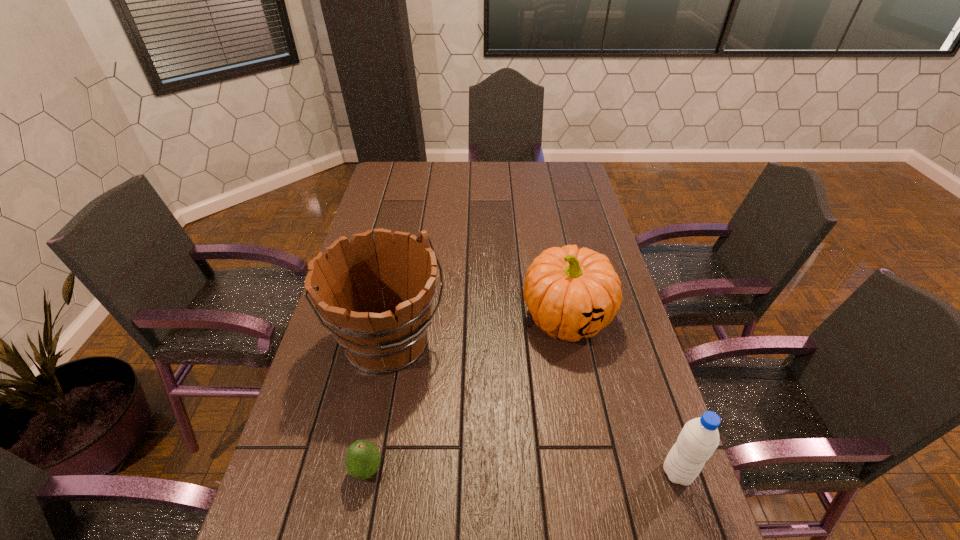
Locate an element on the screen. Image resolution: width=960 pixels, height=540 pixels. vacant space that is in between the rightmost object and the pumpkin is located at coordinates (622, 395).

You are a GUI agent. You are given a task and a screenshot of the screen. Output one action in this format:
    pyautogui.click(x=<x>, y=<y>)
    Task: Click on the free space between the avocado and the tallest object
    This screenshot has width=960, height=540.
    Given the screenshot: What is the action you would take?
    pyautogui.click(x=378, y=407)

At what (x,y) coordinates should I click in order to perform the action: click on free spot between the shortest object and the wine bucket. Please return your answer as a coordinate pair (x, y). Image resolution: width=960 pixels, height=540 pixels. Looking at the image, I should click on (378, 407).

At what (x,y) coordinates should I click in order to perform the action: click on vacant space that is in between the tallest object and the rightmost object. Please return your answer as a coordinate pair (x, y). The width and height of the screenshot is (960, 540). Looking at the image, I should click on (534, 408).

Locate an element on the screen. unoccupied area between the water bottle and the wine bucket is located at coordinates point(534,408).

I want to click on vacant space that's between the second object from right to left and the wine bucket, so click(478, 330).

Locate an element on the screen. vacant region between the shortest object and the pumpkin is located at coordinates (467, 394).

You are a GUI agent. You are given a task and a screenshot of the screen. Output one action in this format:
    pyautogui.click(x=<x>, y=<y>)
    Task: Click on the empty location between the rightmost object and the tallest object
    
    Given the screenshot: What is the action you would take?
    pyautogui.click(x=534, y=408)

Find the location of a particular element. This screenshot has width=960, height=540. free space between the avocado and the wine bucket is located at coordinates (x=378, y=407).

Where is `unoccupied area between the tallest object and the water bottle`? The image size is (960, 540). unoccupied area between the tallest object and the water bottle is located at coordinates (534, 408).